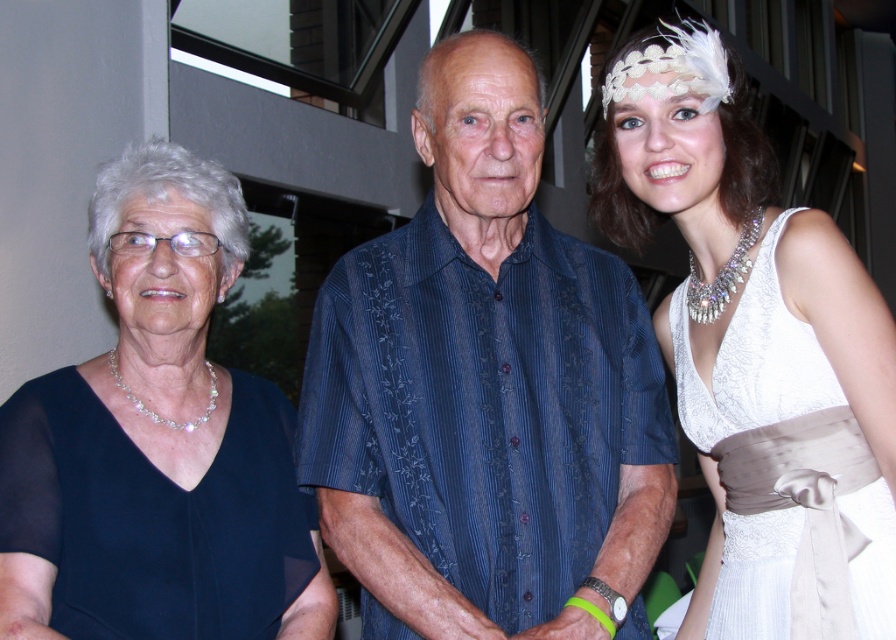
Measure the distance between matte black dress at left and white satin dress at right.

A distance of 37.99 inches exists between matte black dress at left and white satin dress at right.

Is matte black dress at left to the right of white satin dress at right from the viewer's perspective?

No, matte black dress at left is not to the right of white satin dress at right.

Is point (238, 266) farther from viewer compared to point (856, 572)?

Yes, it is behind point (856, 572).

The height and width of the screenshot is (640, 896). Find the location of `matte black dress at left`. matte black dress at left is located at coordinates (166, 438).

Between blue striped shirt at center and white satin dress at right, which one appears on the right side from the viewer's perspective?

white satin dress at right

Does point (382, 301) come behind point (770, 621)?

Yes, point (382, 301) is farther from viewer.

Where is `blue striped shirt at center`? blue striped shirt at center is located at coordinates (485, 388).

Locate an element on the screen. Image resolution: width=896 pixels, height=640 pixels. blue striped shirt at center is located at coordinates (485, 388).

Between blue striped shirt at center and matte black dress at left, which one is positioned lower?

→ Positioned lower is matte black dress at left.

Can you confirm if blue striped shirt at center is smaller than matte black dress at left?

No, blue striped shirt at center is not smaller than matte black dress at left.

Is point (336, 273) positioned after point (322, 632)?

That is True.

The image size is (896, 640). I want to click on blue striped shirt at center, so click(x=485, y=388).